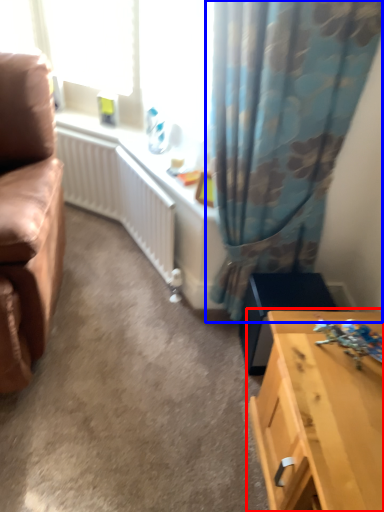
Question: Which object appears closest to the camera in this image, table (highlighted by a red box) or curtain (highlighted by a blue box)?

Choices:
 (A) table
 (B) curtain

Answer: (A)